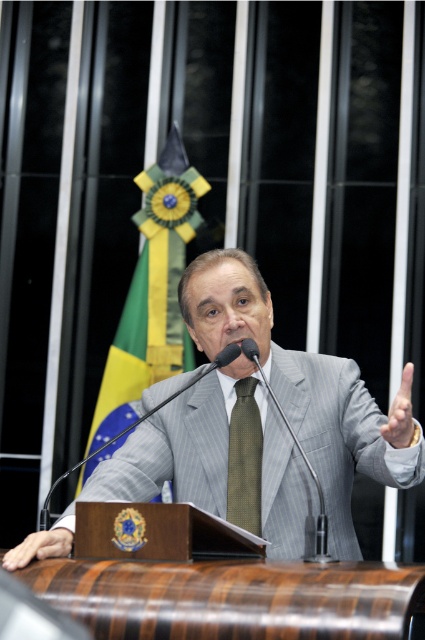
Can you confirm if metallic silver microphone at center is positioned above smooth skin hand at lower left?

Indeed, metallic silver microphone at center is positioned over smooth skin hand at lower left.

Which is more to the right, metallic silver microphone at center or smooth skin hand at lower left?

Positioned to the right is metallic silver microphone at center.

Where is `metallic silver microphone at center`? metallic silver microphone at center is located at coordinates (302, 458).

Where is `metallic silver microphone at center`? This screenshot has height=640, width=425. metallic silver microphone at center is located at coordinates (302, 458).

How distant is green textured tie at center from metallic silver microphone at center?

They are 20.97 centimeters apart.

Does green textured tie at center appear under metallic silver microphone at center?

Yes.

Between point (260, 435) and point (272, 396), which one is positioned behind?

The point (260, 435) is more distant.

Image resolution: width=425 pixels, height=640 pixels. Identify the location of green textured tie at center. (244, 458).

Does green fabric flag at center have a larger size compared to smooth skin hand at lower left?

Correct, green fabric flag at center is larger in size than smooth skin hand at lower left.

Between green fabric flag at center and smooth skin hand at lower left, which one has more height?

Standing taller between the two is green fabric flag at center.

Is point (155, 268) positioned in front of point (68, 547)?

That is False.

I want to click on green fabric flag at center, so click(x=153, y=289).